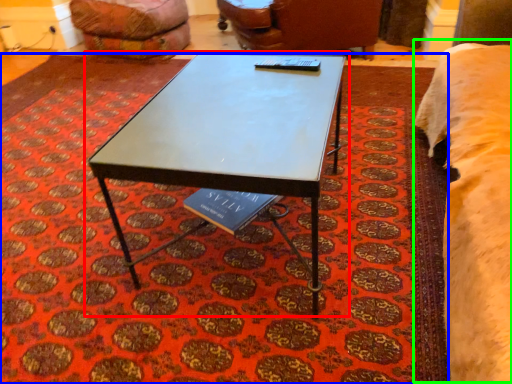
Question: Which object is the closest to the coffee table (highlighted by a red box)? Choose among these: mat (highlighted by a blue box) or bed (highlighted by a green box).

Choices:
 (A) mat
 (B) bed

Answer: (A)